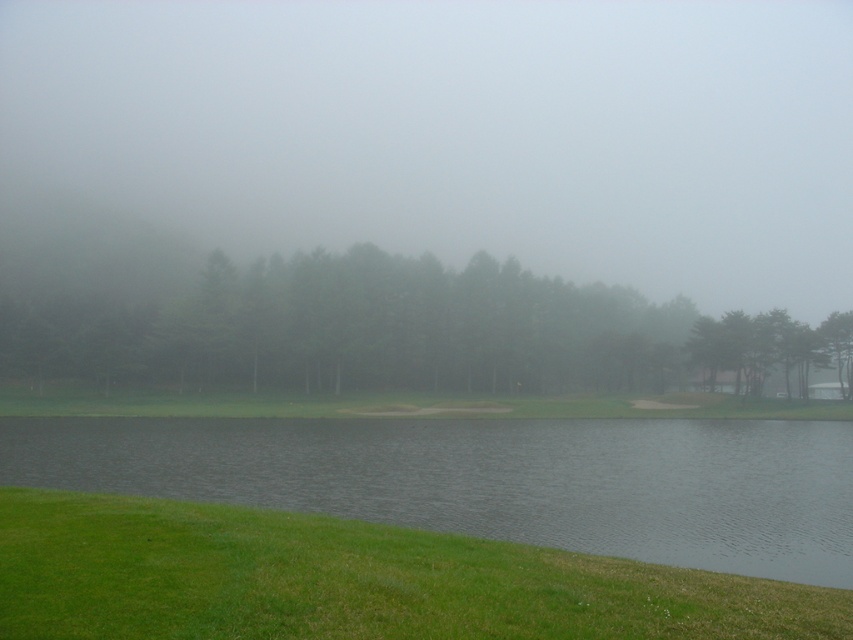
Consider the image. Which of these two, gray water at lower center or green matte trees at center, stands taller?

green matte trees at center is taller.

Can you confirm if gray water at lower center is shorter than green matte trees at center?

Correct, gray water at lower center is not as tall as green matte trees at center.

Where is `gray water at lower center`? The width and height of the screenshot is (853, 640). gray water at lower center is located at coordinates (492, 480).

Find the location of a particular element. The width and height of the screenshot is (853, 640). gray water at lower center is located at coordinates (492, 480).

Can you confirm if green matte trees at center is thinner than green matte tree at upper right?

In fact, green matte trees at center might be wider than green matte tree at upper right.

Is green matte trees at center further to the viewer compared to green matte tree at upper right?

Yes, green matte trees at center is behind green matte tree at upper right.

What do you see at coordinates (392, 332) in the screenshot? I see `green matte trees at center` at bounding box center [392, 332].

Locate an element on the screen. green matte trees at center is located at coordinates (392, 332).

Is gray water at lower center shorter than green grass at lower left?

Incorrect, gray water at lower center's height does not fall short of green grass at lower left's.

The width and height of the screenshot is (853, 640). Describe the element at coordinates (492, 480) in the screenshot. I see `gray water at lower center` at that location.

Who is more distant from viewer, [91,464] or [210,620]?

Point [91,464]

I want to click on gray water at lower center, so click(492, 480).